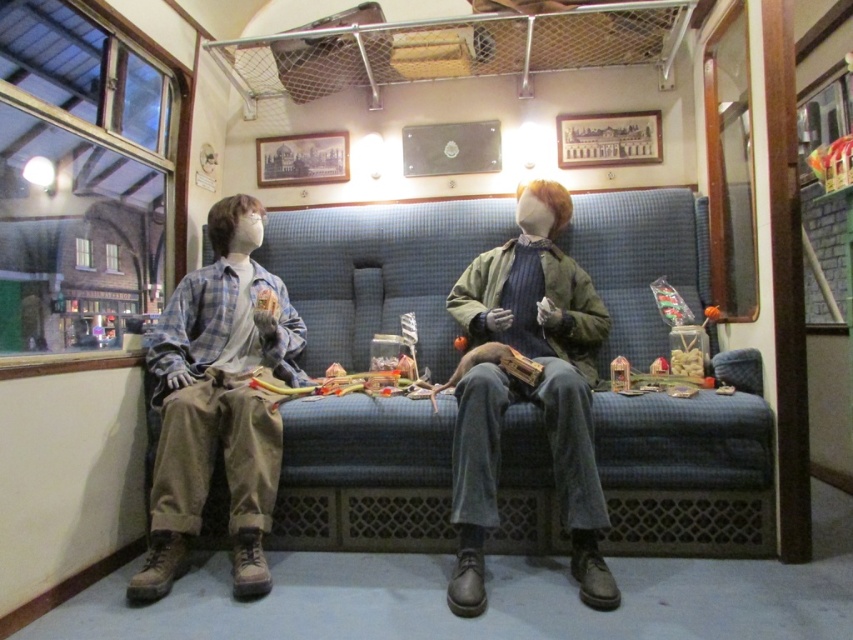
Who is positioned more to the right, blue fabric couch at center or denim jacket at center?

Positioned to the right is denim jacket at center.

Is blue fabric couch at center to the left of denim jacket at center from the viewer's perspective?

Correct, you'll find blue fabric couch at center to the left of denim jacket at center.

Which is in front, point (309, 513) or point (474, 460)?

Point (474, 460) is in front.

Locate an element on the screen. The height and width of the screenshot is (640, 853). blue fabric couch at center is located at coordinates (689, 467).

Which is more to the left, denim shirt at left or denim jacket at center?

Positioned to the left is denim shirt at left.

Which is below, denim shirt at left or denim jacket at center?

denim shirt at left is below.

Between point (161, 502) and point (456, 472), which one is positioned behind?

The point (161, 502) is more distant.

Locate an element on the screen. denim shirt at left is located at coordinates (218, 403).

Is blue fabric couch at center bigger than denim shirt at left?

Incorrect, blue fabric couch at center is not larger than denim shirt at left.

Can you confirm if blue fabric couch at center is positioned above denim shirt at left?

No.

Describe the element at coordinates (689, 467) in the screenshot. The width and height of the screenshot is (853, 640). I see `blue fabric couch at center` at that location.

Identify the location of blue fabric couch at center. The height and width of the screenshot is (640, 853). (689, 467).